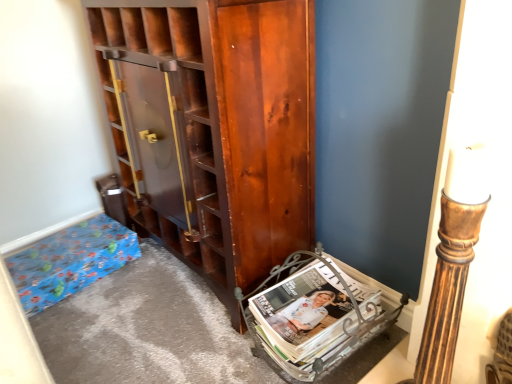
The image size is (512, 384). Find the location of `free space to the right of blue paper bag at lower left`. free space to the right of blue paper bag at lower left is located at coordinates pos(145,278).